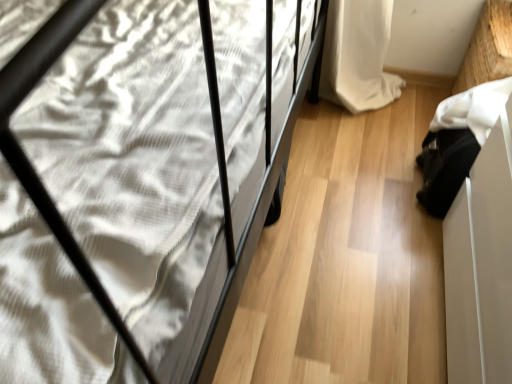
This screenshot has height=384, width=512. Identify the location of matte black bed at left. (129, 162).

Image resolution: width=512 pixels, height=384 pixels. What do you see at coordinates (129, 162) in the screenshot?
I see `matte black bed at left` at bounding box center [129, 162].

I want to click on matte black bed at left, so click(129, 162).